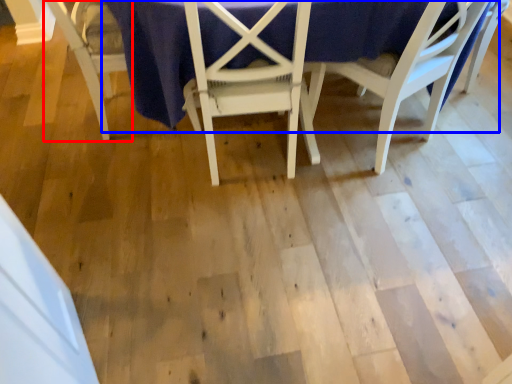
Question: Which of the following is the closest to the observer, chair (highlighted by a red box) or table (highlighted by a blue box)?

Choices:
 (A) chair
 (B) table

Answer: (B)